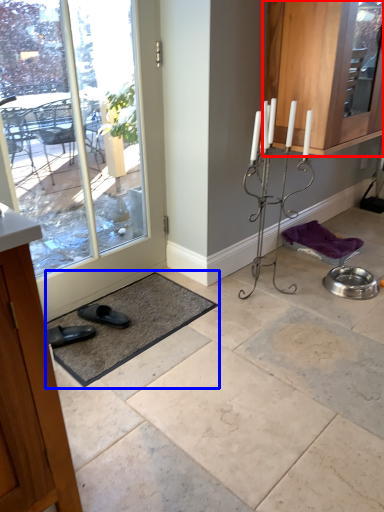
Question: Among these objects, which one is farthest to the camera, cabinetry (highlighted by a red box) or bath mat (highlighted by a blue box)?

Choices:
 (A) cabinetry
 (B) bath mat

Answer: (A)